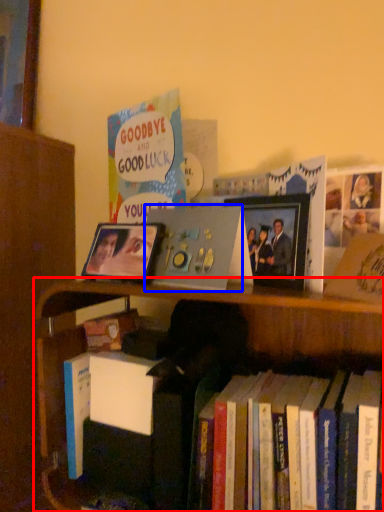
Question: Which of the following is the farthest to the observer, bookcase (highlighted by a red box) or paperback book (highlighted by a blue box)?

Choices:
 (A) bookcase
 (B) paperback book

Answer: (B)